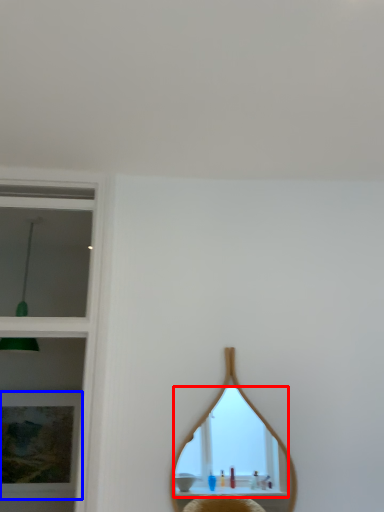
Question: Which object is further to the camera taking this photo, mirror (highlighted by a red box) or picture frame (highlighted by a blue box)?

Choices:
 (A) mirror
 (B) picture frame

Answer: (B)